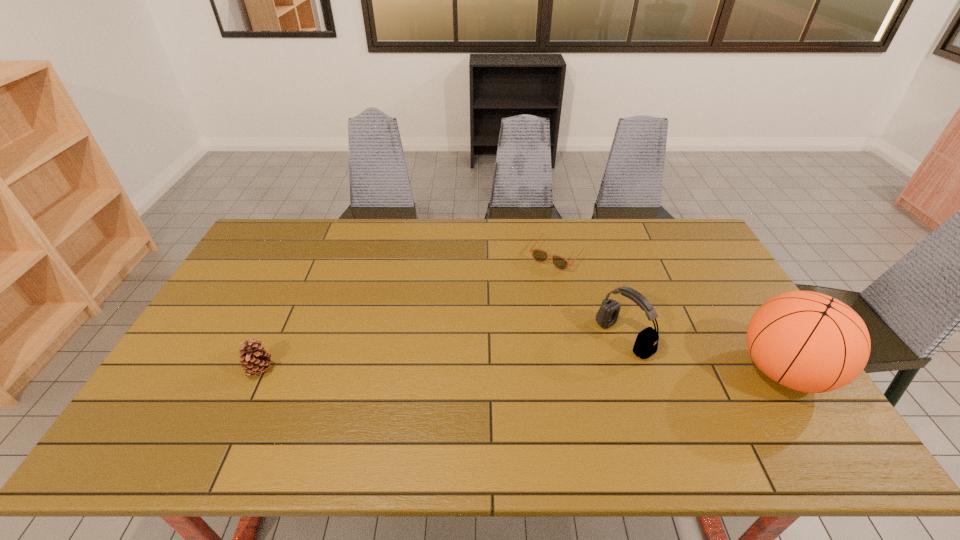
The height and width of the screenshot is (540, 960). In order to click on vacant space at the left edge of the desktop in this screenshot , I will do `click(188, 349)`.

Find the location of `vacant space at the far right corner of the desktop`. vacant space at the far right corner of the desktop is located at coordinates (694, 257).

Where is `free space at the near right corner of the desktop`? This screenshot has width=960, height=540. free space at the near right corner of the desktop is located at coordinates (749, 391).

This screenshot has width=960, height=540. I want to click on empty space between the headset and the leftmost object, so pos(442,354).

The image size is (960, 540). I want to click on vacant space that is in between the basketball and the third shortest object, so click(704, 354).

I want to click on free space between the tallest object and the headset, so click(x=704, y=354).

This screenshot has height=540, width=960. I want to click on vacant space in between the second shortest object and the rightmost object, so click(x=522, y=370).

Where is `free spot between the second shortest object and the rightmost object`? free spot between the second shortest object and the rightmost object is located at coordinates (522, 370).

Where is `empty space between the third tallest object and the third shortest object`? This screenshot has width=960, height=540. empty space between the third tallest object and the third shortest object is located at coordinates (442, 354).

Locate an element on the screen. free space between the rightmost object and the leftmost object is located at coordinates (522, 370).